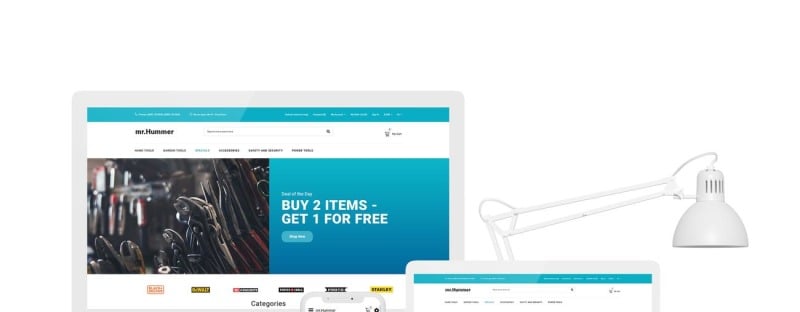
Locate an element on the screen. lamp is located at coordinates (714, 221).